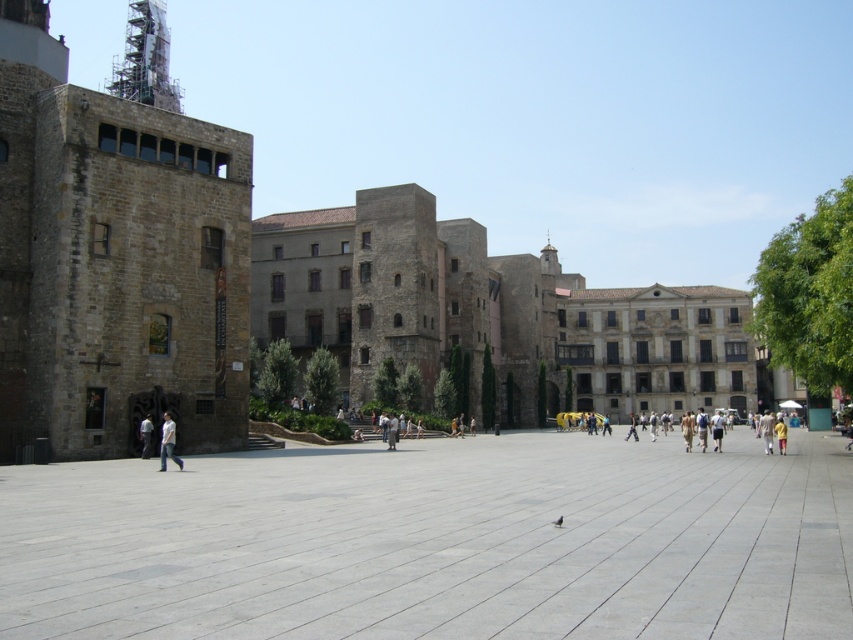
Which is below, yellow cotton shirt at lower right or white cotton shirt at center?

yellow cotton shirt at lower right is below.

The height and width of the screenshot is (640, 853). I want to click on yellow cotton shirt at lower right, so pos(766,429).

Is smooth concrete courtyard at center to the left of white cotton shirt at center from the viewer's perspective?

No, smooth concrete courtyard at center is not to the left of white cotton shirt at center.

Consider the image. Is smooth concrete courtyard at center wider than white cotton shirt at center?

Yes.

Is point (782, 618) closer to viewer compared to point (146, 420)?

That is True.

I want to click on smooth concrete courtyard at center, so click(x=437, y=541).

Can you confirm if white matte shirt at lower left is positioned below white cotton shirt at center?

No, white matte shirt at lower left is not below white cotton shirt at center.

Is white matte shirt at lower left taller than white cotton shirt at center?

Correct, white matte shirt at lower left is much taller as white cotton shirt at center.

Is point (169, 444) farther from viewer compared to point (143, 440)?

No, (169, 444) is in front of (143, 440).

I want to click on white matte shirt at lower left, so click(167, 442).